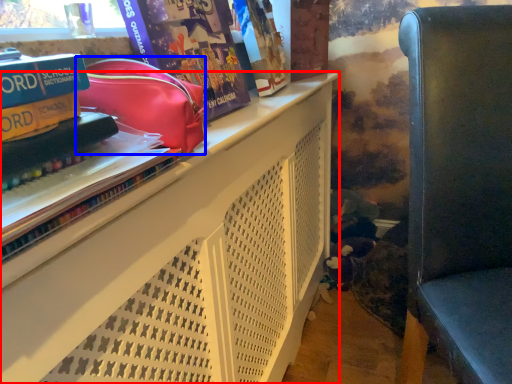
Question: Which object appears closest to the camera in this image, shelf (highlighted by a red box) or bag (highlighted by a blue box)?

Choices:
 (A) shelf
 (B) bag

Answer: (A)